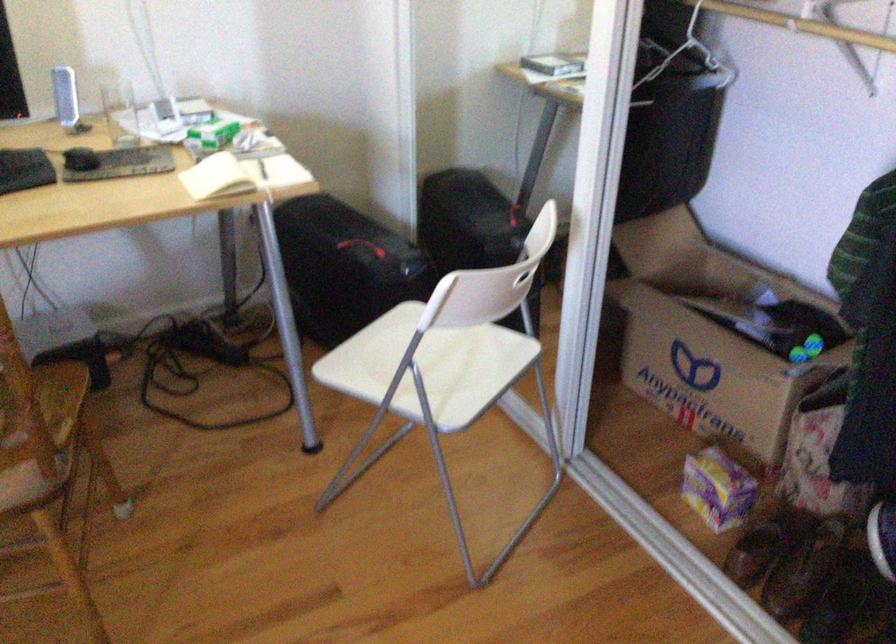
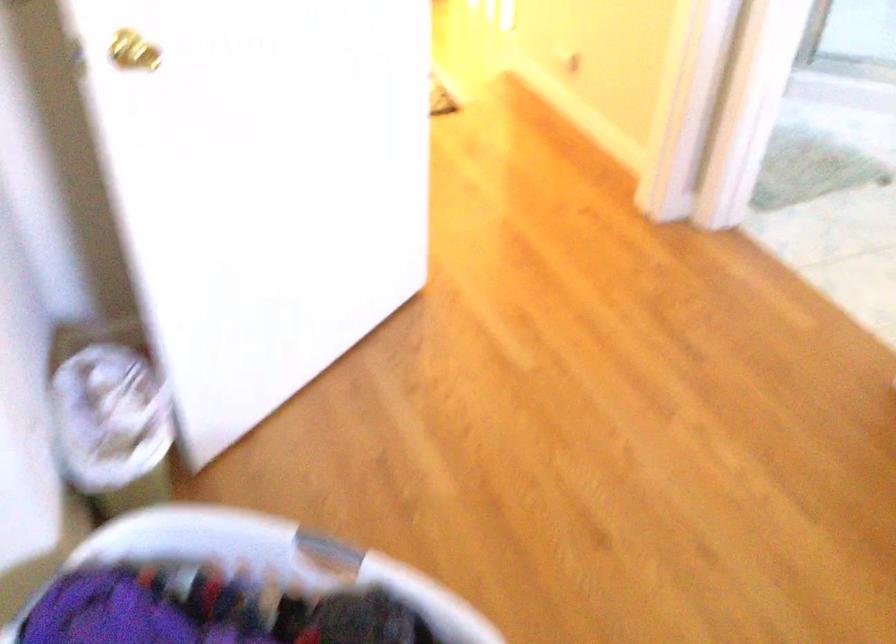
The images are taken continuously from a first-person perspective. In which direction is your viewpoint rotating?

The camera rotated toward right-down.